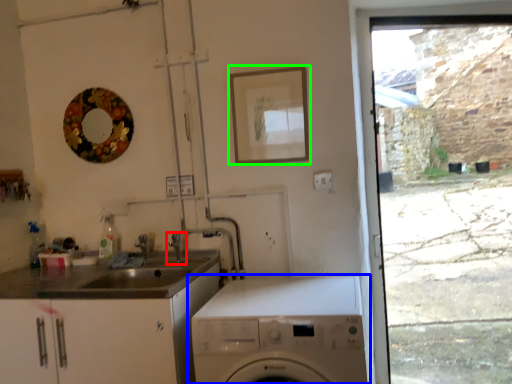
Question: Estimate the real-world distances between objects in this image. Which object is farther from tap (highlighted by a red box), washing machine (highlighted by a blue box) or picture frame (highlighted by a green box)?

Choices:
 (A) washing machine
 (B) picture frame

Answer: (A)